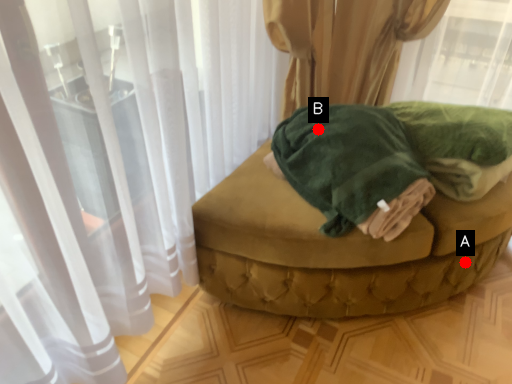
Question: Two points are circled on the image, labeled by A and B beside each circle. Which point appears closest to the camera in this image?

Choices:
 (A) A is closer
 (B) B is closer

Answer: (B)